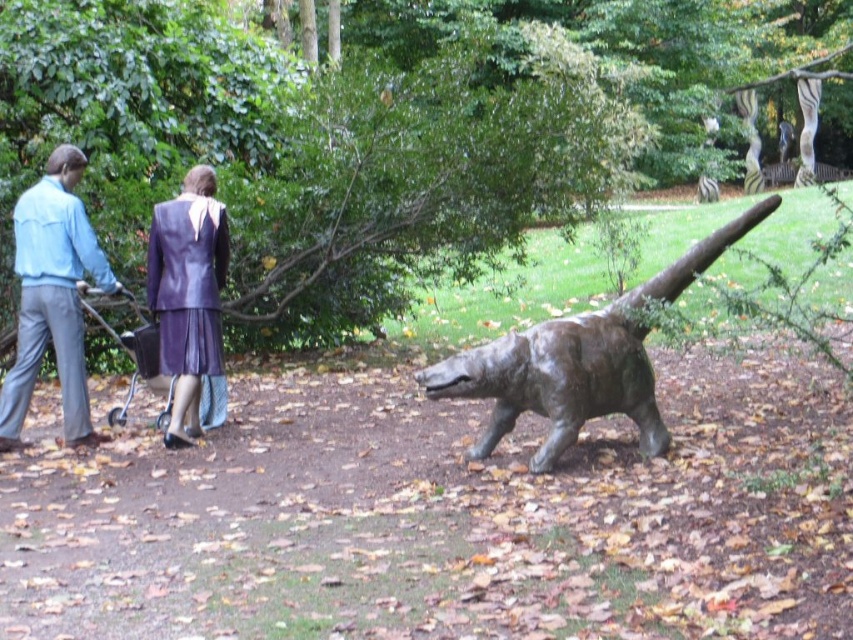
You are standing at the entrance of the park and want to locate the bronze statue at center. According to the coordinates provided, in which direction should you walk from your current position to reach it?

The bronze statue at center is located at coordinates point [579,362]. Since the coordinate system is not specified, but assuming standard image coordinates where the origin is at the bottom left corner, the x increases to the right and y increases upwards, you should walk towards the upper right direction from your current position to reach the bronze statue at center.

You are standing in the park and see the light blue denim jacket at left and the purple leather suit at upper left. Which one is closer to you?

The light blue denim jacket at left is closer to you because it is in front of the purple leather suit at upper left.

You are a photographer standing in the park and want to take a photo of the purple leather suit at upper left and the metallic silver baby carriage at left. Which object should you focus on first to ensure both are in clear focus?

The purple leather suit at upper left is closer to the viewer than the metallic silver baby carriage at left, so you should focus on the purple leather suit at upper left first to ensure both are in clear focus.